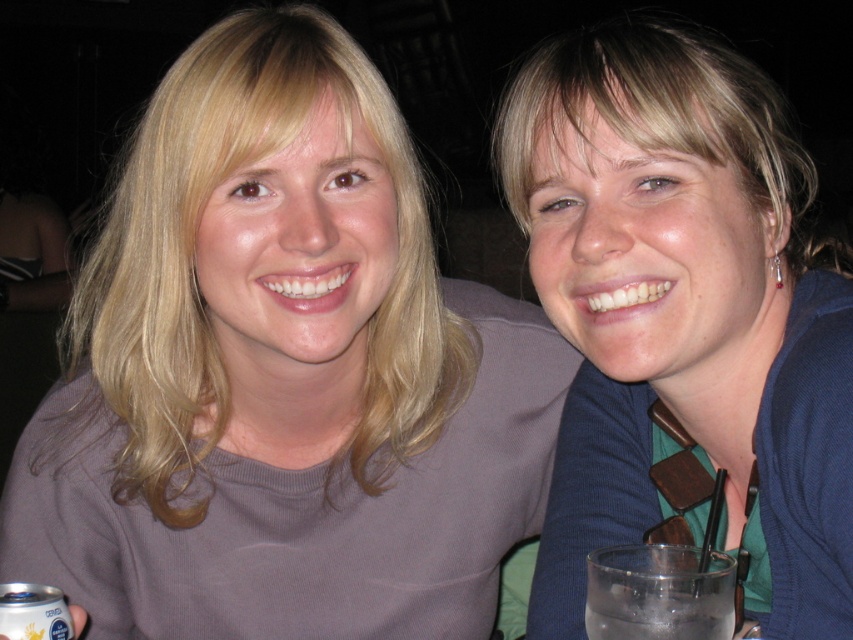
You are a photographer trying to capture a clear shot of both the matte gray sweater at upper left and the blue fabric shirt at upper right. However, you notice that one of them is blocking the view of the other. Which one is blocking the other?

The blue fabric shirt at upper right is behind matte gray sweater at upper left, so the matte gray sweater at upper left is blocking the view of the blue fabric shirt at upper right.

You are a bartender who needs to determine which object is larger between the matte gray sweater at upper left and the clear glass at lower right. Based on the scene description, which one is bigger?

The matte gray sweater at upper left is bigger than the clear glass at lower right according to the description.